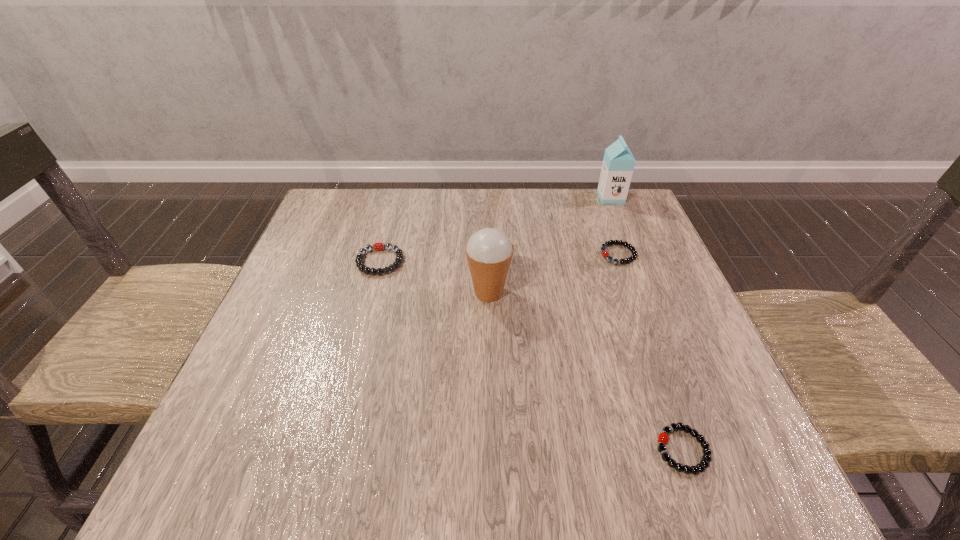
In order to click on object that can be found as the fourth closest to the fourth object from right to left in this screenshot , I will do `click(618, 164)`.

Locate an element on the screen. object that can be found as the third closest to the fourth object from right to left is located at coordinates (663, 438).

At what (x,y) coordinates should I click in order to perform the action: click on the second closest bracelet to the milk carton. Please return your answer as a coordinate pair (x, y). The width and height of the screenshot is (960, 540). Looking at the image, I should click on (378, 246).

Locate which bracelet ranks in proximity to the nearest bracelet. Please provide its 2D coordinates. Your answer should be formatted as a tuple, i.e. [(x, y)], where the tuple contains the x and y coordinates of a point satisfying the conditions above.

[(605, 254)]